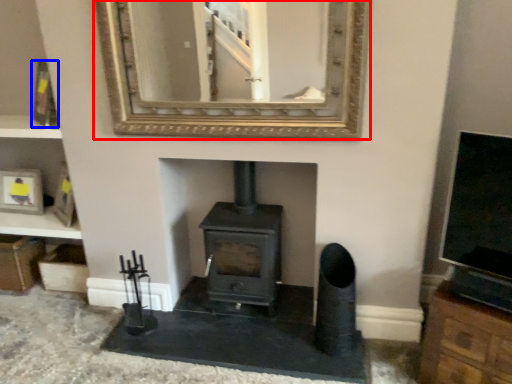
Question: Which object appears closest to the camera in this image, mirror (highlighted by a red box) or picture frame (highlighted by a blue box)?

Choices:
 (A) mirror
 (B) picture frame

Answer: (A)